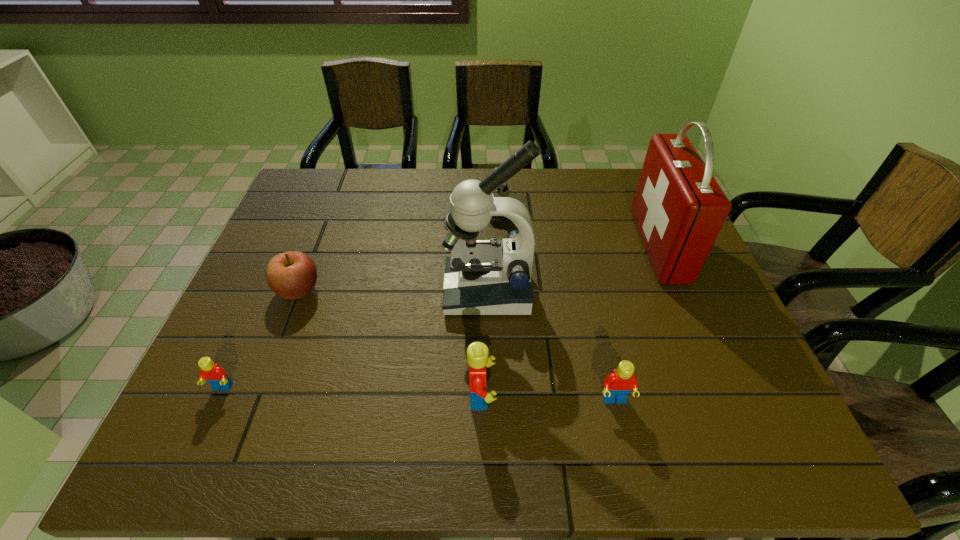
I want to click on the shortest object, so click(215, 375).

What are the coordinates of `the leftmost Lego` in the screenshot? It's located at (215, 375).

Identify the location of the second Lego from right to left. (478, 358).

The width and height of the screenshot is (960, 540). What are the coordinates of `the second object from right to left` in the screenshot? It's located at (617, 385).

At what (x,y) coordinates should I click in order to perform the action: click on the second tallest Lego. Please return your answer as a coordinate pair (x, y). The height and width of the screenshot is (540, 960). Looking at the image, I should click on (617, 385).

Find the location of a particular element. This screenshot has height=540, width=960. microphone is located at coordinates (503, 191).

In order to click on the second tallest object in this screenshot , I will do `click(679, 208)`.

Locate an element on the screen. The height and width of the screenshot is (540, 960). the rightmost object is located at coordinates pos(679,208).

The height and width of the screenshot is (540, 960). Identify the location of apple. (291, 275).

Find the location of `microscope`. microscope is located at coordinates (482, 276).